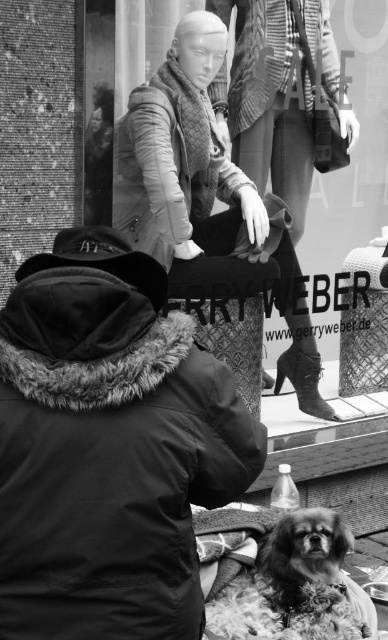
Question: Can you confirm if matte beige coat at center is bigger than fluffy fur dog at lower center?

Choices:
 (A) no
 (B) yes

Answer: (B)

Question: Is matte beige coat at center bigger than fluffy fur dog at lower center?

Choices:
 (A) no
 (B) yes

Answer: (B)

Question: Where is matte beige coat at center located in relation to fluffy fur dog at lower center in the image?

Choices:
 (A) below
 (B) above

Answer: (B)

Question: Which point appears closest to the camera in this image?

Choices:
 (A) (159, 189)
 (B) (273, 618)

Answer: (B)

Question: Which point is closer to the camera taking this photo?

Choices:
 (A) (299, 314)
 (B) (320, 600)

Answer: (B)